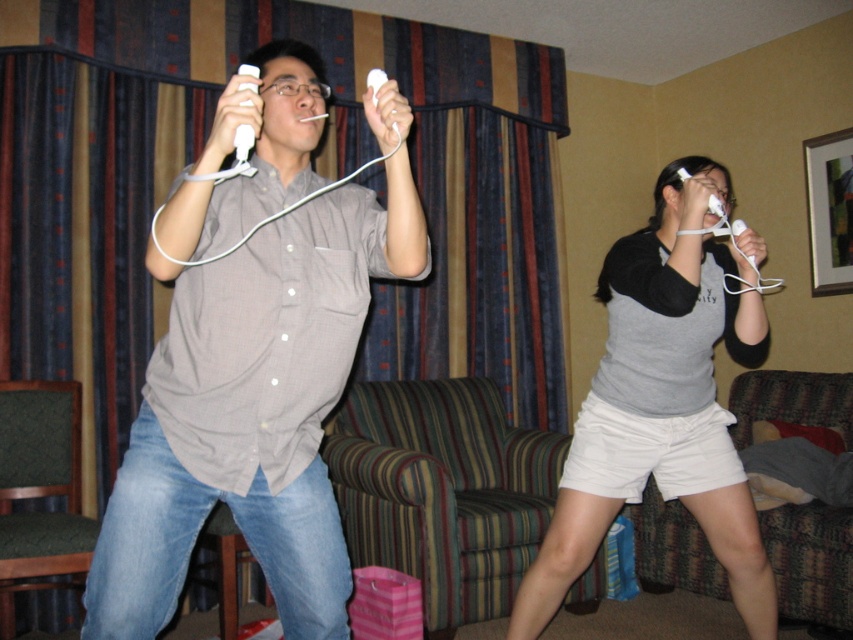
You are standing in the room and want to hand the white matte remote at upper center to the person wearing the matte gray shirt at center. Can you reach the remote without moving the shirt?

Answer: The matte gray shirt at center is located below the white matte remote at upper center, so yes, you can reach the remote without moving the shirt.

You are a delivery robot in a hotel room. You need to place a package on the white matte remote at upper center. The package is 1 foot in length. Can you fit it there without overlapping the gray cotton shirt at center?

The distance between the gray cotton shirt at center and the white matte remote at upper center is 4.02 feet. Since the package is only 1 foot long, there is enough space to place it on the white matte remote at upper center without overlapping the gray cotton shirt at center.

You are designing a storage box for the gray cotton shirt at center and the white matte remote at upper center. Given their sizes, which object should you prioritize placing first into the box to ensure both fit?

The gray cotton shirt at center is larger in size than the white matte remote at upper center, so you should place the gray cotton shirt at center first to ensure both fit properly.